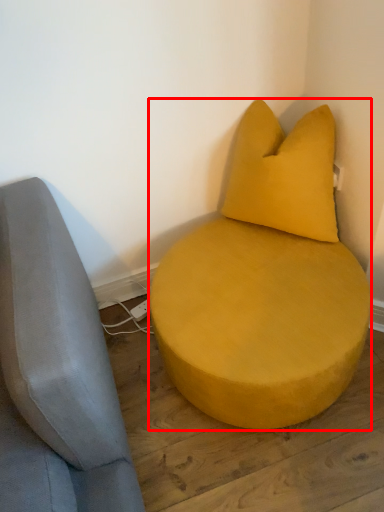
Question: In this image, where is furniture (annotated by the red box) located relative to pillow?

Choices:
 (A) right
 (B) left

Answer: (B)